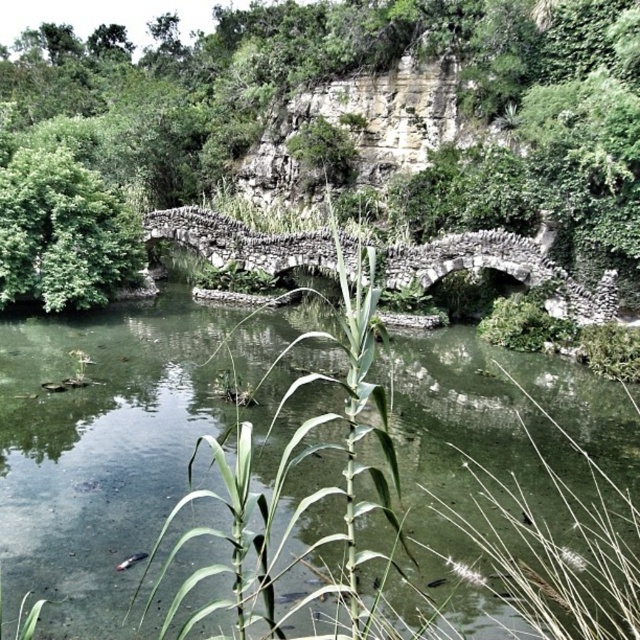
Question: Which point is closer to the camera?

Choices:
 (A) (628, 461)
 (B) (624, 4)

Answer: (A)

Question: Which point is closer to the camera?

Choices:
 (A) (305, 576)
 (B) (148, 170)

Answer: (A)

Question: Is green stone bridge at center further to camera compared to green leafy tree at center?

Choices:
 (A) yes
 (B) no

Answer: (B)

Question: Which object appears closest to the camera in this image?

Choices:
 (A) green leafy tree at center
 (B) green stone bridge at center

Answer: (B)

Question: Does green stone bridge at center appear on the right side of green leafy tree at center?

Choices:
 (A) yes
 (B) no

Answer: (A)

Question: Does green stone bridge at center lie in front of green leafy tree at center?

Choices:
 (A) yes
 (B) no

Answer: (A)